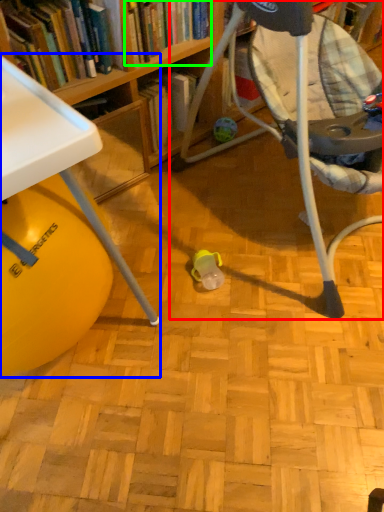
Question: Estimate the real-world distances between objects in this image. Which object is closer to chair (highlighted by a red box), table (highlighted by a blue box) or book (highlighted by a green box)?

Choices:
 (A) table
 (B) book

Answer: (B)